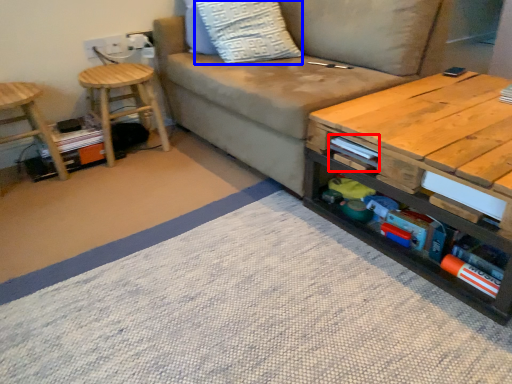
Question: Among these objects, which one is farthest to the camera, book (highlighted by a red box) or throw pillow (highlighted by a blue box)?

Choices:
 (A) book
 (B) throw pillow

Answer: (B)